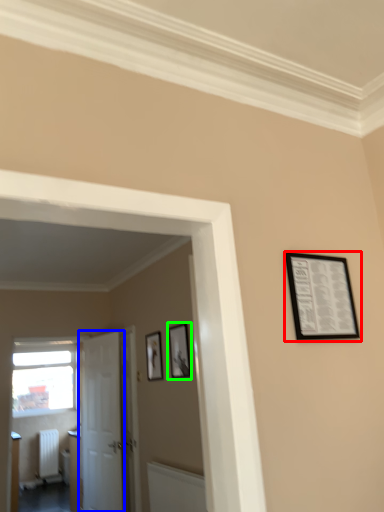
Question: Based on their relative distances, which object is farther from picture frame (highlighted by a red box)? Choose from door (highlighted by a blue box) and picture frame (highlighted by a green box).

Choices:
 (A) door
 (B) picture frame

Answer: (A)